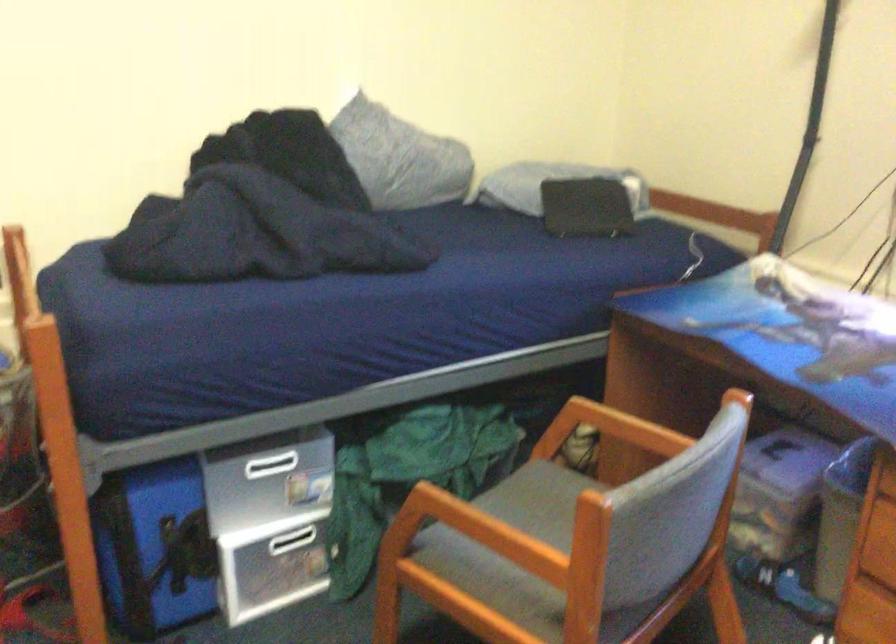
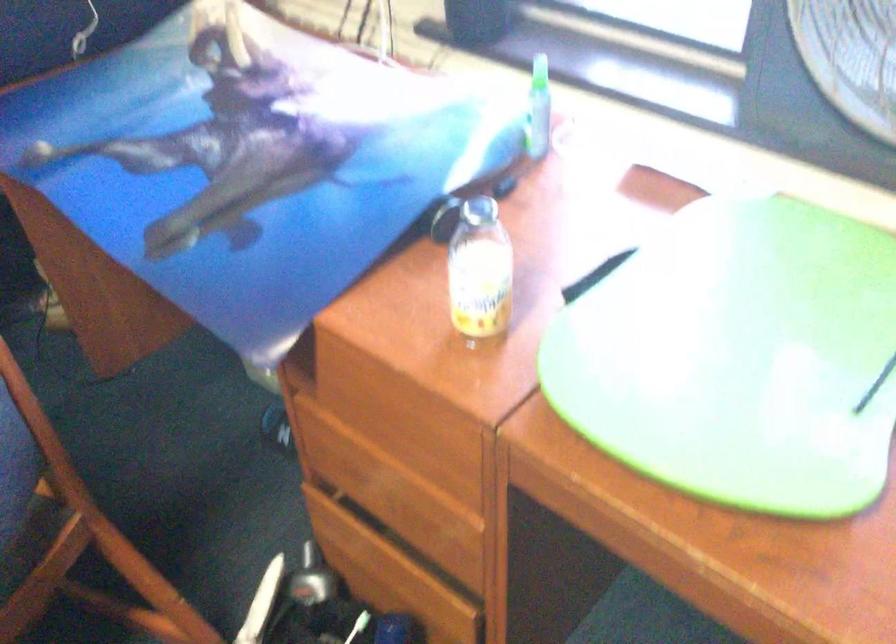
Question: Based on the continuous images, in which direction is the camera rotating? Reply with the corresponding letter.

Choices:
 (A) Left
 (B) Right
 (C) Up
 (D) Down

Answer: (D)